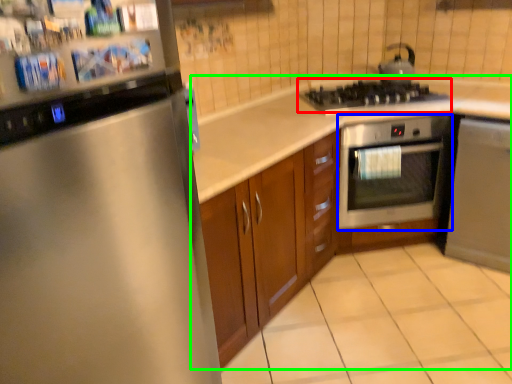
Question: Based on their relative distances, which object is farther from gas stove (highlighted by a red box)? Choose from oven (highlighted by a blue box) and countertop (highlighted by a green box).

Choices:
 (A) oven
 (B) countertop

Answer: (B)